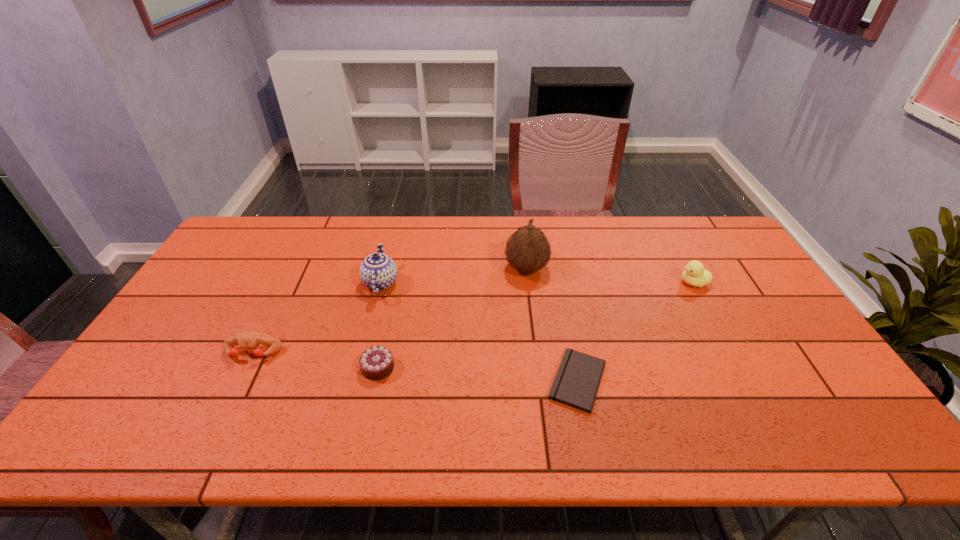
At what (x,y) coordinates should I click in order to perform the action: click on vacant space located 0.060m at the spout of the second tallest object. Please return your answer as a coordinate pair (x, y). The width and height of the screenshot is (960, 540). Looking at the image, I should click on (418, 283).

Locate an element on the screen. This screenshot has width=960, height=540. vacant space located at the beak of the duckling is located at coordinates (634, 282).

Locate an element on the screen. vacant space located 0.310m at the beak of the duckling is located at coordinates (580, 282).

Locate an element on the screen. This screenshot has height=540, width=960. free location located at the beak of the duckling is located at coordinates (634, 282).

Identify the location of free space located 0.090m with the gloves of the puncher facing forward. The height and width of the screenshot is (540, 960). (233, 393).

The width and height of the screenshot is (960, 540). Find the location of `free location located 0.200m on the right of the chocolate cake`. free location located 0.200m on the right of the chocolate cake is located at coordinates (472, 368).

What are the coordinates of `vacant area situated on the right of the shortest object` in the screenshot? It's located at (646, 381).

You are a GUI agent. You are given a task and a screenshot of the screen. Output one action in this format:
    pyautogui.click(x=<x>, y=<y>)
    Task: Click on the object that is positioned at the far edge
    The width and height of the screenshot is (960, 540).
    Given the screenshot: What is the action you would take?
    pyautogui.click(x=528, y=250)

Image resolution: width=960 pixels, height=540 pixels. In the image, there is a desktop. Find the location of `vacant space at the far edge`. vacant space at the far edge is located at coordinates (674, 232).

Image resolution: width=960 pixels, height=540 pixels. Find the location of `vacant space at the near edge of the desktop`. vacant space at the near edge of the desktop is located at coordinates (463, 439).